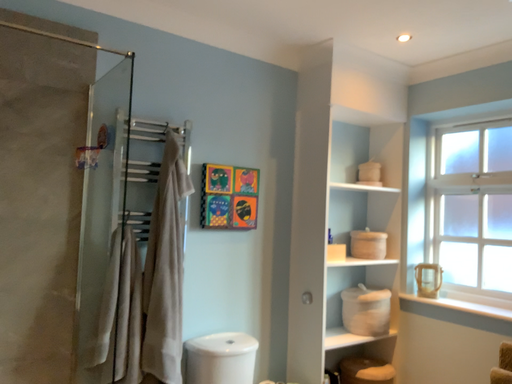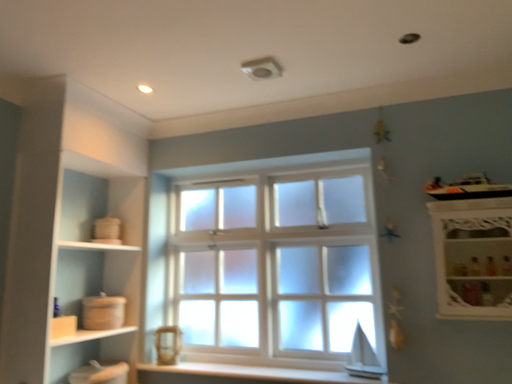
Question: Which way did the camera rotate in the video?

Choices:
 (A) rotated upward
 (B) rotated downward

Answer: (A)